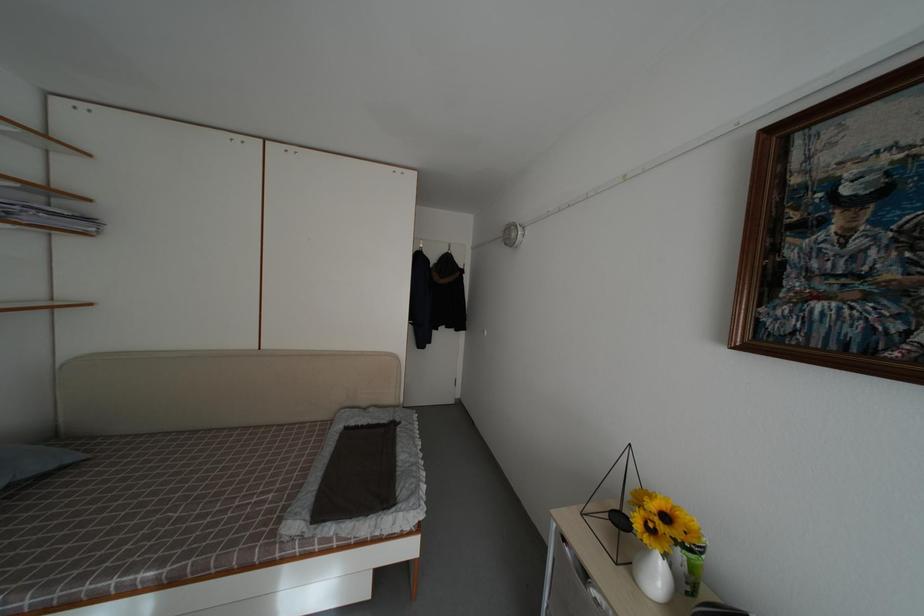
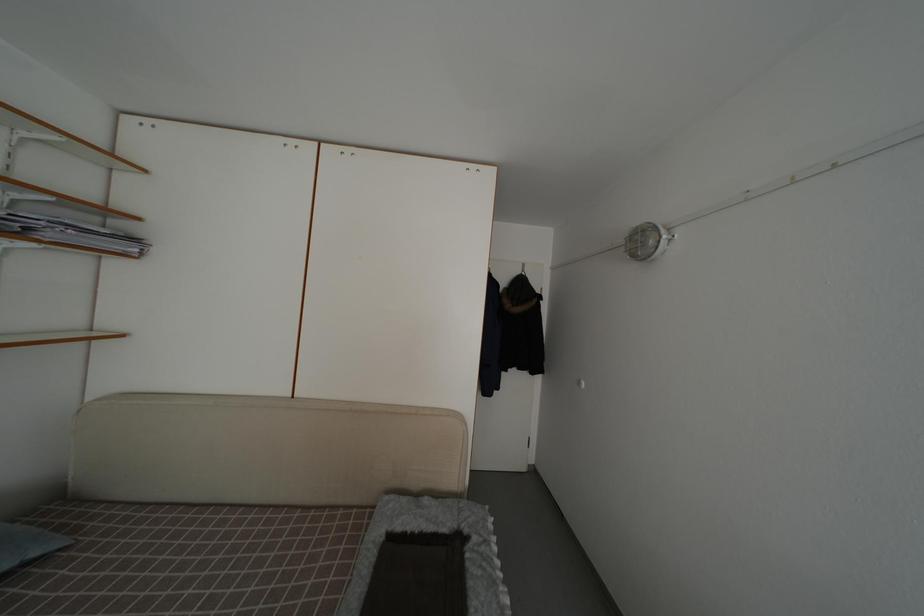
Question: The first image is from the beginning of the video and the second image is from the end. How did the camera likely rotate when shooting the video?

Choices:
 (A) Left
 (B) Right
 (C) Up
 (D) Down

Answer: (A)